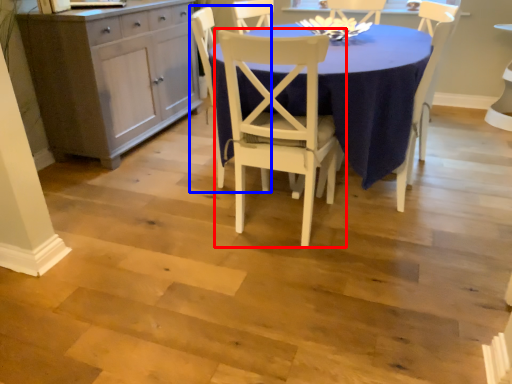
Question: Among these objects, which one is farthest to the camera, chair (highlighted by a red box) or chair (highlighted by a blue box)?

Choices:
 (A) chair
 (B) chair

Answer: (B)